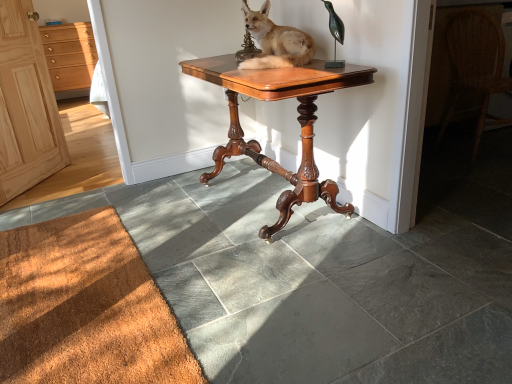
Question: Is light wood cabinet at left to the left or to the right of brown textured mat at lower left in the image?

Choices:
 (A) left
 (B) right

Answer: (A)

Question: From their relative heights in the image, would you say light wood cabinet at left is taller or shorter than brown textured mat at lower left?

Choices:
 (A) short
 (B) tall

Answer: (B)

Question: Which object is the closest to the natural wood cabinet at left?

Choices:
 (A) woven wicker chair at right
 (B) light wood cabinet at left
 (C) brown fur stuffed fox at center
 (D) brown textured mat at lower left
 (E) mahogany wood table at center

Answer: (D)

Question: Considering the real-world distances, which object is farthest from the brown textured mat at lower left?

Choices:
 (A) natural wood cabinet at left
 (B) woven wicker chair at right
 (C) brown fur stuffed fox at center
 (D) mahogany wood table at center
 (E) light wood cabinet at left

Answer: (E)